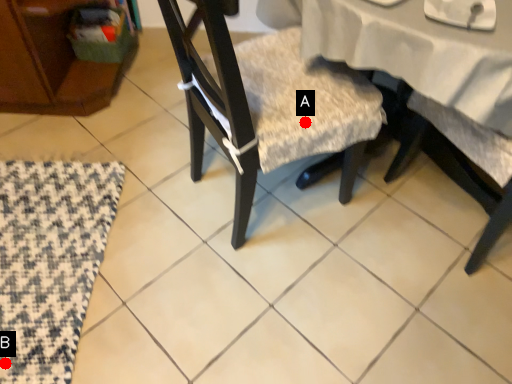
Question: Two points are circled on the image, labeled by A and B beside each circle. Which point is farther from the camera taking this photo?

Choices:
 (A) A is further
 (B) B is further

Answer: (B)